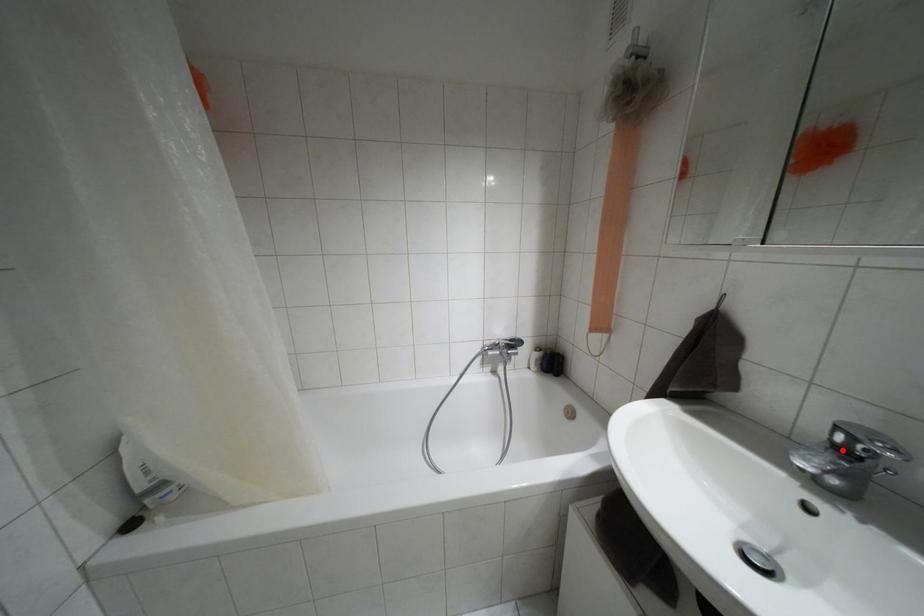
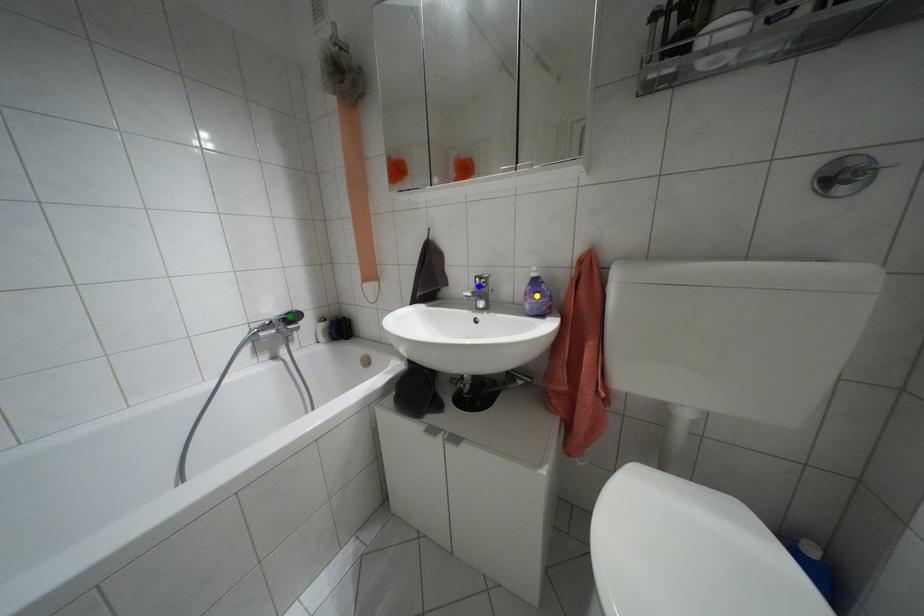
Question: I am providing you with two images of the same scene from different viewpoints. A red point is marked on the first image. You are given multiple points on the second image. Which point in image 2 represents the same 3d spot as the red point in image 1?

Choices:
 (A) blue point
 (B) green point
 (C) yellow point

Answer: (A)